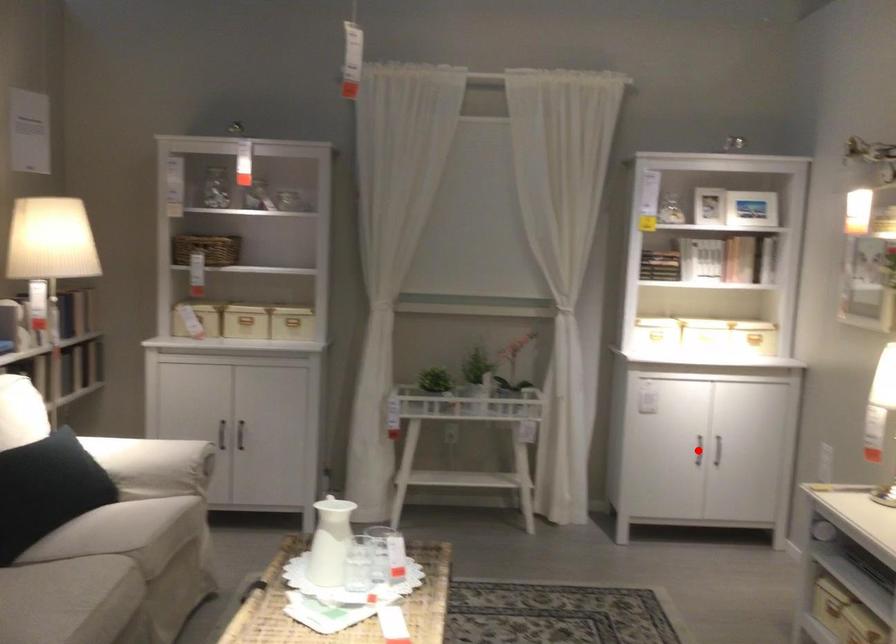
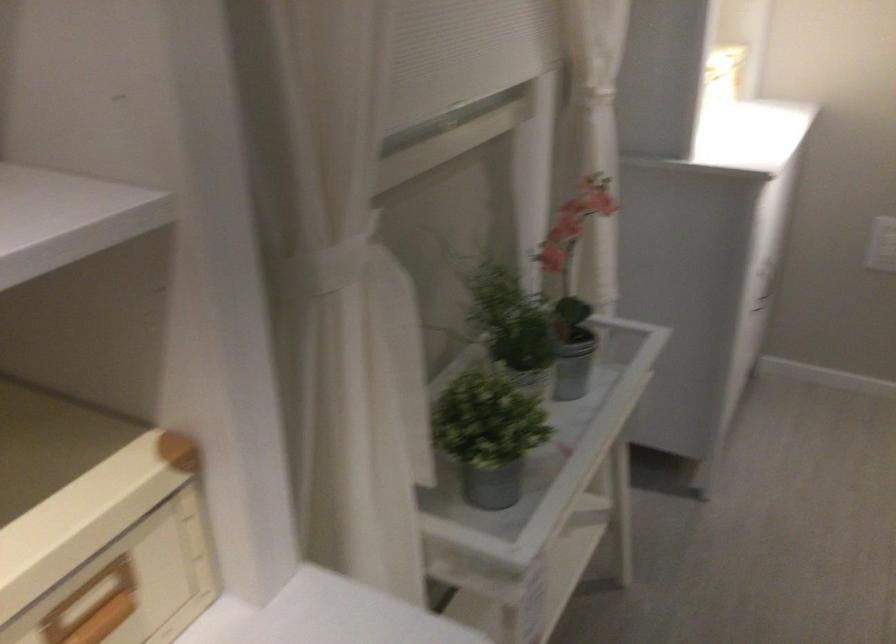
Question: I am providing you with two images of the same scene from different viewpoints. A red point is marked on the first image. At the location where the point appears in image 1, is it still visible in image 2?

Choices:
 (A) Yes
 (B) No

Answer: (B)